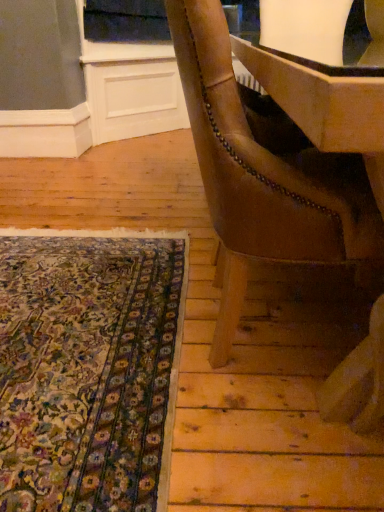
The image size is (384, 512). What are the coordinates of `blank space above floral carpet at lower left (from a real-world perspective)` in the screenshot? It's located at (76, 314).